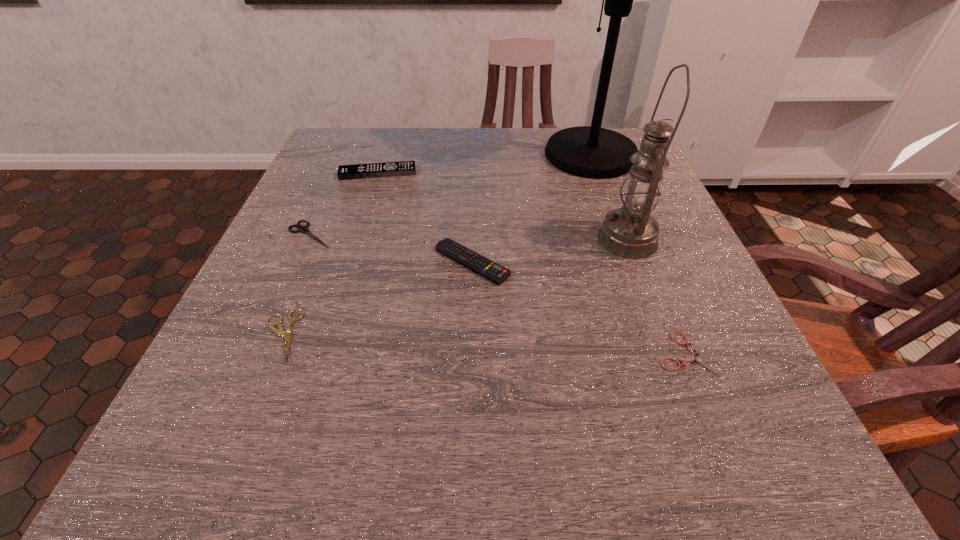
The image size is (960, 540). I want to click on free space at the near left corner of the desktop, so click(x=261, y=495).

Locate an element on the screen. The image size is (960, 540). free space that is in between the farthest shears and the second tallest shears is located at coordinates click(x=296, y=285).

Where is `vacant area that lies between the second shortest shears and the oil lamp`? vacant area that lies between the second shortest shears and the oil lamp is located at coordinates (454, 288).

Find the location of a particular element. empty space between the table lamp and the right remote control is located at coordinates (531, 208).

Identify the location of vacant area between the nearer remote control and the sixth shortest object. This screenshot has height=540, width=960. (550, 251).

Find the location of a particular element. free space between the table lamp and the fifth tallest object is located at coordinates (450, 194).

This screenshot has height=540, width=960. Identify the location of vacant region between the tallest object and the sixth tallest object. (436, 245).

Where is `vacant region between the sixth tallest object and the shorter remote control`? vacant region between the sixth tallest object and the shorter remote control is located at coordinates (376, 299).

Identify the location of unoccupied position between the second tallest object and the table lamp. This screenshot has width=960, height=540. (609, 197).

The width and height of the screenshot is (960, 540). I want to click on vacant space in between the second tallest object and the right remote control, so click(x=550, y=251).